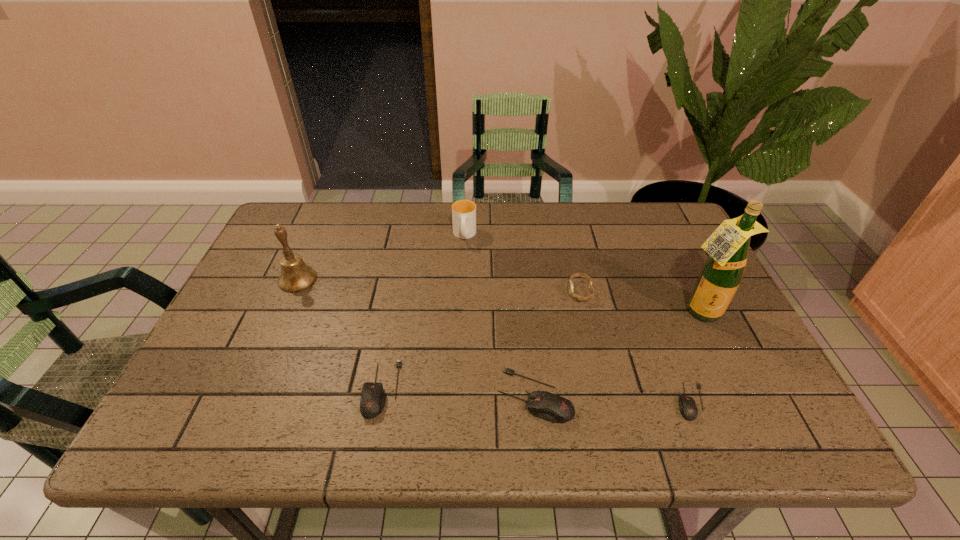
At what (x,y) coordinates should I click in order to perform the action: click on free space located on the face of the fifth object from left to right. Please return your answer as a coordinate pair (x, y). The height and width of the screenshot is (540, 960). Looking at the image, I should click on (437, 292).

I want to click on object situated at the far edge, so tap(463, 211).

Identify the location of object that is at the left edge. This screenshot has width=960, height=540. (296, 276).

You are a GUI agent. You are given a task and a screenshot of the screen. Output one action in this format:
    pyautogui.click(x=<x>, y=<y>)
    Task: Click on the mouse positioned at the right edge
    This screenshot has height=540, width=960.
    Given the screenshot: What is the action you would take?
    pyautogui.click(x=688, y=409)

Locate an element on the screen. liquor that is at the right edge is located at coordinates (722, 273).

This screenshot has width=960, height=540. Find the location of `object that is at the near right corner`. object that is at the near right corner is located at coordinates (688, 409).

Where is `vacant space at the far edge of the desktop`? The width and height of the screenshot is (960, 540). vacant space at the far edge of the desktop is located at coordinates (427, 219).

Locate an element on the screen. free space at the near edge of the desktop is located at coordinates (433, 374).

The width and height of the screenshot is (960, 540). In the image, there is a desktop. Identify the location of vacant space at the left edge. 255,276.

Image resolution: width=960 pixels, height=540 pixels. Find the location of `vacant area at the right edge`. vacant area at the right edge is located at coordinates (690, 251).